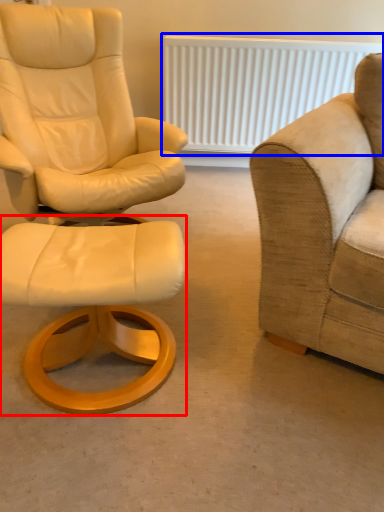
Question: Which object is closer to the camera taking this photo, stool (highlighted by a red box) or radiator (highlighted by a blue box)?

Choices:
 (A) stool
 (B) radiator

Answer: (A)